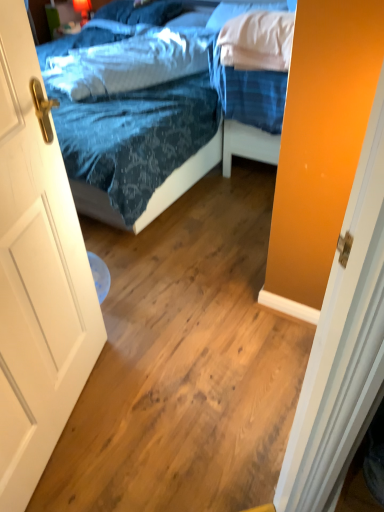
Locate an element on the screen. This screenshot has height=512, width=384. unoccupied area behind white wooden door at left is located at coordinates (130, 339).